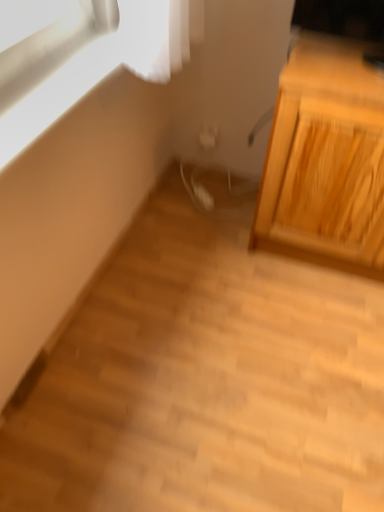
Question: Is light wood cabinet at right taller or shorter than matte white window at upper left?

Choices:
 (A) tall
 (B) short

Answer: (A)

Question: From the image's perspective, is light wood cabinet at right positioned above or below matte white window at upper left?

Choices:
 (A) below
 (B) above

Answer: (A)

Question: Is point (357, 159) positioned closer to the camera than point (26, 13)?

Choices:
 (A) farther
 (B) closer

Answer: (A)

Question: From the image's perspective, is matte white window at upper left above or below light wood cabinet at right?

Choices:
 (A) below
 (B) above

Answer: (B)

Question: Based on their positions, is matte white window at upper left located to the left or right of light wood cabinet at right?

Choices:
 (A) left
 (B) right

Answer: (A)

Question: From a real-world perspective, is matte white window at upper left above or below light wood cabinet at right?

Choices:
 (A) above
 (B) below

Answer: (A)

Question: Is matte white window at upper left spatially inside light wood cabinet at right, or outside of it?

Choices:
 (A) outside
 (B) inside

Answer: (A)